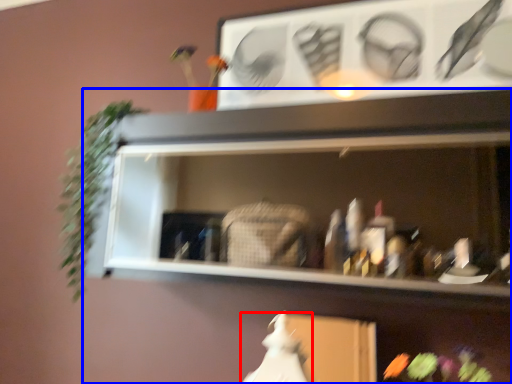
Question: Which object appears farthest to the camera in this image, fancy dress (highlighted by a red box) or shelf (highlighted by a blue box)?

Choices:
 (A) fancy dress
 (B) shelf

Answer: (A)